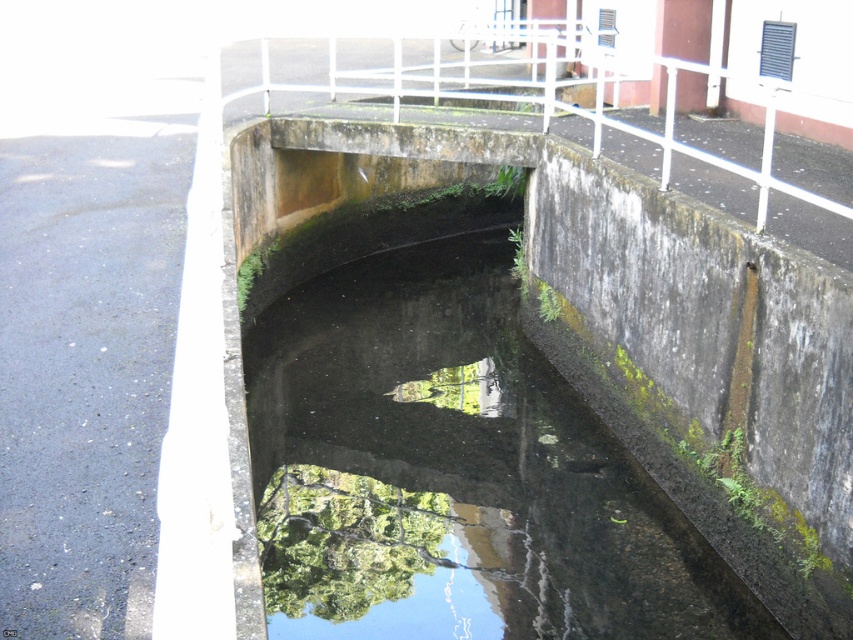
Which is more to the right, green mossy concrete puddle at center or white metal rail at upper center?

white metal rail at upper center

Is green mossy concrete puddle at center in front of white metal rail at upper center?

No, it is behind white metal rail at upper center.

Is point (480, 401) positioned in front of point (370, 86)?

Yes.

Identify the location of green mossy concrete puddle at center. The height and width of the screenshot is (640, 853). (450, 451).